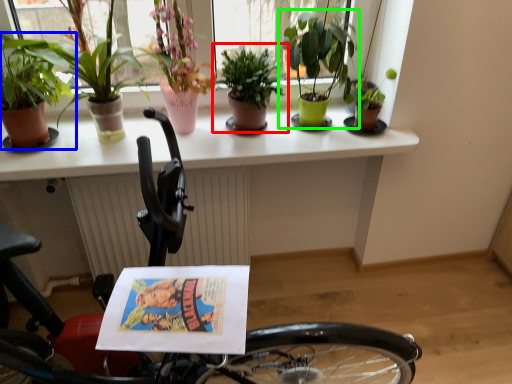
Question: Considering the real-world distances, which object is closest to houseplant (highlighted by a red box)? houseplant (highlighted by a blue box) or houseplant (highlighted by a green box).

Choices:
 (A) houseplant
 (B) houseplant

Answer: (B)